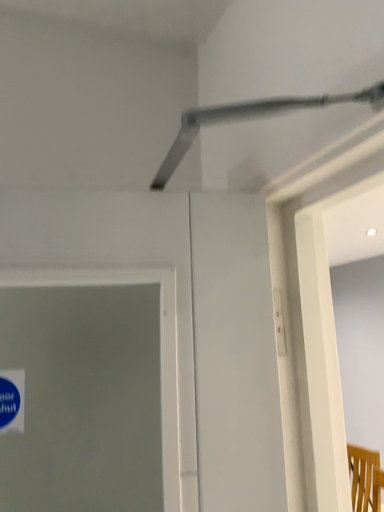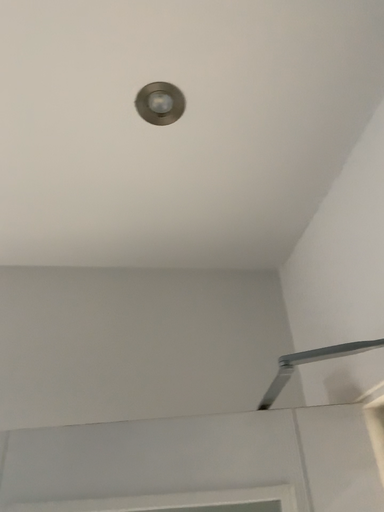
Question: How did the camera likely rotate when shooting the video?

Choices:
 (A) rotated downward
 (B) rotated upward

Answer: (B)